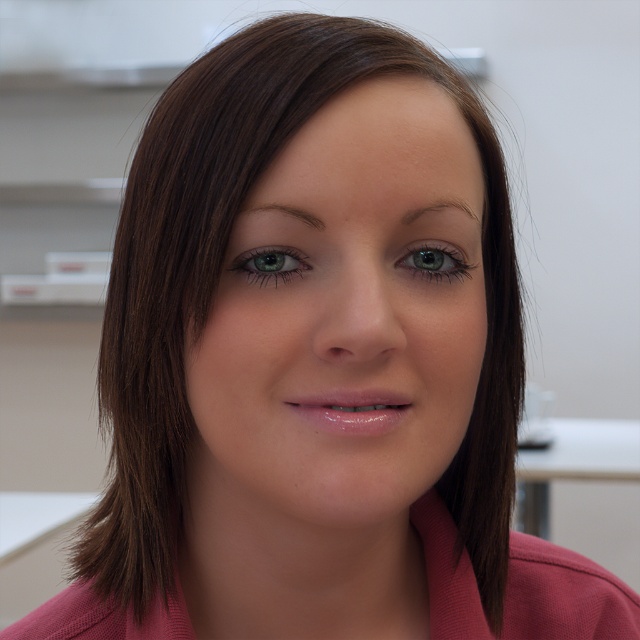
Question: Which is nearer to the smooth skin face at center?

Choices:
 (A) green glossy eye at center
 (B) green matte eye at center

Answer: (B)

Question: Is smooth skin face at center below green glossy eye at center?

Choices:
 (A) no
 (B) yes

Answer: (B)

Question: Does green matte eye at center have a lesser width compared to green glossy eye at center?

Choices:
 (A) no
 (B) yes

Answer: (A)

Question: Is smooth skin face at center above green matte eye at center?

Choices:
 (A) no
 (B) yes

Answer: (A)

Question: Which of the following is the closest to the observer?

Choices:
 (A) smooth skin face at center
 (B) green matte eye at center
 (C) green glossy eye at center

Answer: (A)

Question: Which of these objects is positioned farthest from the green glossy eye at center?

Choices:
 (A) smooth skin face at center
 (B) green matte eye at center

Answer: (B)